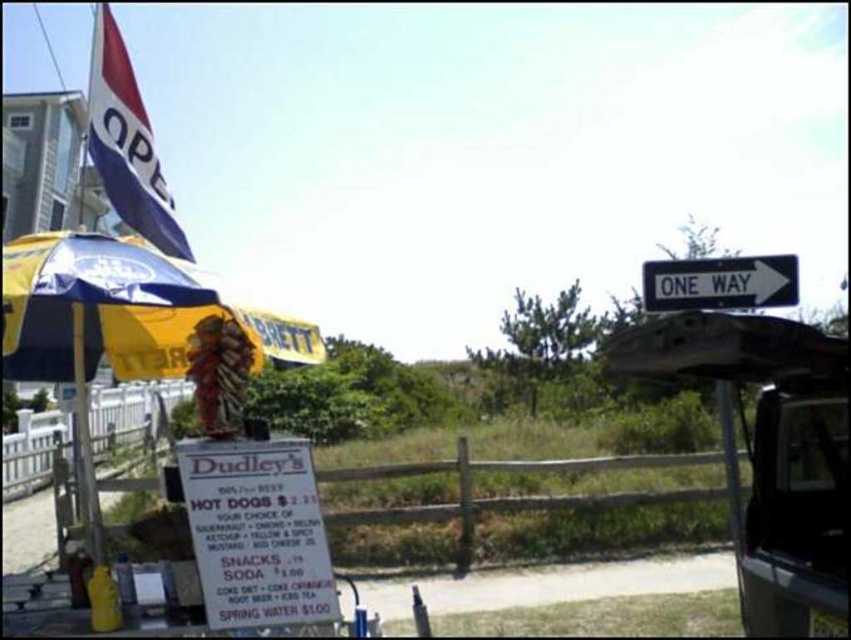
You are a delivery person trying to deliver a package to the food stand. You have to navigate between the white plastic street sign at upper right and the yellow matte pole at left. The package requires a clear path of at least 15 feet. Can you safely pass through the space between them?

The white plastic street sign at upper right and yellow matte pole at left are 17.29 feet apart, which is more than the required 15 feet. Therefore, you can safely pass through the space between them with the package.